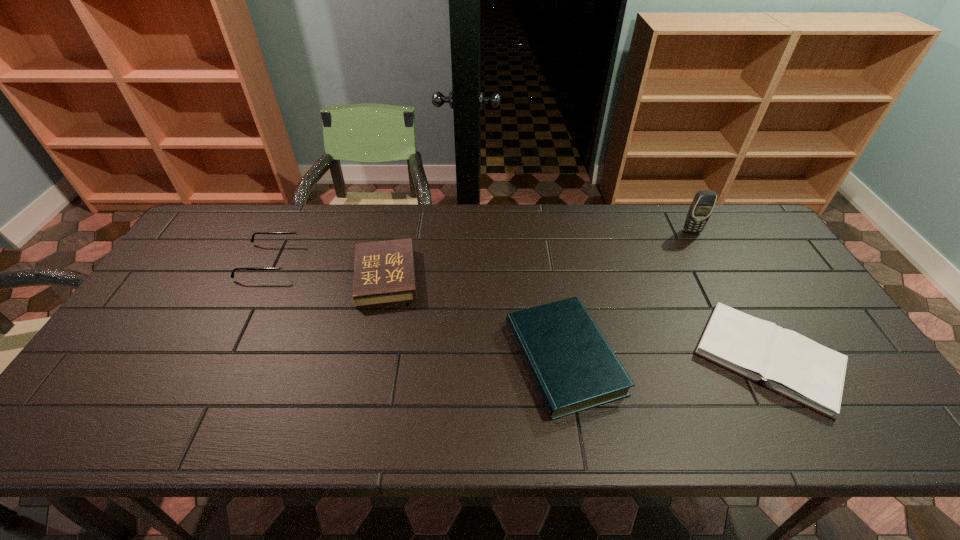
Locate an element on the screen. Image resolution: width=960 pixels, height=540 pixels. vacant area at the right edge of the desktop is located at coordinates click(x=776, y=279).

The width and height of the screenshot is (960, 540). Find the location of `vacant space at the far left corner of the desktop`. vacant space at the far left corner of the desktop is located at coordinates (230, 218).

Find the location of a particular element. vacant area that lies between the rightmost hardback book and the second hardback book from right to left is located at coordinates (666, 358).

Locate an element on the screen. The width and height of the screenshot is (960, 540). vacant point located between the third object from right to left and the rightmost hardback book is located at coordinates (666, 358).

Locate an element on the screen. The image size is (960, 540). free space between the leftmost hardback book and the spectacles is located at coordinates (328, 269).

Where is `vacant area that lies between the second hardback book from right to left and the shortest object`? This screenshot has width=960, height=540. vacant area that lies between the second hardback book from right to left and the shortest object is located at coordinates (666, 358).

Image resolution: width=960 pixels, height=540 pixels. What are the coordinates of `vacant space that's between the spectacles and the cellular telephone` in the screenshot? It's located at (481, 246).

Find the location of `empty location between the third object from left to right and the rightmost hardback book`. empty location between the third object from left to right and the rightmost hardback book is located at coordinates [x=666, y=358].

Where is `free space that is in between the third object from right to left and the second object from left to right`? Image resolution: width=960 pixels, height=540 pixels. free space that is in between the third object from right to left and the second object from left to right is located at coordinates (475, 318).

Locate an element on the screen. vacant region between the tallest object and the second hardback book from left to right is located at coordinates (628, 295).